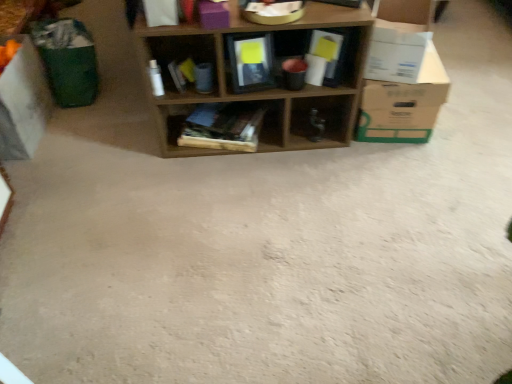
Question: From a real-world perspective, is white cardboard box at right, the 2th cardboard box from the left, positioned under wooden books at center, placed as the 2th shelf when sorted from left to right, based on gravity?

Choices:
 (A) no
 (B) yes

Answer: (A)

Question: Is white cardboard box at right, the 2th cardboard box when ordered from right to left, to the left of wooden books at center, the 2th shelf positioned from the right, from the viewer's perspective?

Choices:
 (A) yes
 (B) no

Answer: (B)

Question: Is the depth of white cardboard box at right, the 2th cardboard box from the left, greater than that of wooden books at center, placed as the 2th shelf when sorted from left to right?

Choices:
 (A) no
 (B) yes

Answer: (A)

Question: Does white cardboard box at right, the 2th cardboard box from the left, have a lesser width compared to wooden books at center, the 2th shelf positioned from the right?

Choices:
 (A) no
 (B) yes

Answer: (B)

Question: Does white cardboard box at right, the 2th cardboard box from the left, have a larger size compared to wooden books at center, placed as the 2th shelf when sorted from left to right?

Choices:
 (A) yes
 (B) no

Answer: (A)

Question: Would you say white cardboard box at right, the 2th cardboard box when ordered from right to left, is inside or outside white cardboard box at right, acting as the third cardboard box starting from the left?

Choices:
 (A) outside
 (B) inside

Answer: (A)

Question: In the image, is white cardboard box at right, the 2th cardboard box when ordered from right to left, on the left side or the right side of white cardboard box at right, which is counted as the first cardboard box, starting from the right?

Choices:
 (A) left
 (B) right

Answer: (A)

Question: From the image's perspective, is white cardboard box at right, the 2th cardboard box when ordered from right to left, above or below white cardboard box at right, which is counted as the first cardboard box, starting from the right?

Choices:
 (A) below
 (B) above

Answer: (B)

Question: Is point (415, 51) closer or farther from the camera than point (358, 122)?

Choices:
 (A) closer
 (B) farther

Answer: (A)

Question: Does point (185, 56) appear closer or farther from the camera than point (193, 132)?

Choices:
 (A) farther
 (B) closer

Answer: (B)

Question: In the image, is wooden shelf at center, which is counted as the first shelf, starting from the right, on the left side or the right side of wooden books at center, placed as the 2th shelf when sorted from left to right?

Choices:
 (A) left
 (B) right

Answer: (B)

Question: From a real-world perspective, is wooden shelf at center, which is the third shelf from left to right, physically located above or below wooden books at center, placed as the 2th shelf when sorted from left to right?

Choices:
 (A) below
 (B) above

Answer: (B)

Question: In terms of width, does wooden shelf at center, which is counted as the first shelf, starting from the right, look wider or thinner when compared to wooden books at center, the 2th shelf positioned from the right?

Choices:
 (A) wide
 (B) thin

Answer: (B)

Question: Is white cardboard box at left, placed as the 1th cardboard box when sorted from left to right, to the left or to the right of wooden books at center, the 2th shelf positioned from the right, in the image?

Choices:
 (A) right
 (B) left

Answer: (B)

Question: In terms of width, does white cardboard box at left, acting as the 3th cardboard box starting from the right, look wider or thinner when compared to wooden books at center, the 2th shelf positioned from the right?

Choices:
 (A) thin
 (B) wide

Answer: (A)